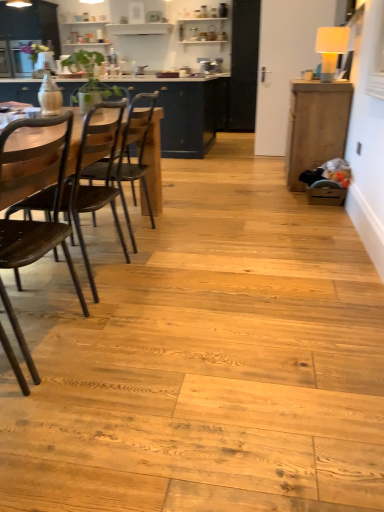
You are a GUI agent. You are given a task and a screenshot of the screen. Output one action in this format:
    pyautogui.click(x=<x>, y=<y>)
    Task: Click on the wooden cabinet at right, acting as the 2th cabinetry starting from the left
    
    Given the screenshot: What is the action you would take?
    pyautogui.click(x=316, y=126)

The image size is (384, 512). Describe the element at coordinates (316, 126) in the screenshot. I see `wooden cabinet at right, marked as the 1th cabinetry in a front-to-back arrangement` at that location.

Locate an element on the screen. The height and width of the screenshot is (512, 384). wooden chair at left, positioned as the 3th chair in front-to-back order is located at coordinates (125, 155).

I want to click on wooden cabinet at right, which is the second cabinetry in back-to-front order, so click(316, 126).

Which is more to the right, matte dark wood cabinet at center, the second cabinetry positioned from the front, or wooden chair at left, positioned as the 3th chair in front-to-back order?

From the viewer's perspective, wooden chair at left, positioned as the 3th chair in front-to-back order, appears more on the right side.

In the scene shown: Which is behind, matte dark wood cabinet at center, the second cabinetry positioned from the front, or wooden chair at left, acting as the first chair starting from the back?

matte dark wood cabinet at center, the second cabinetry positioned from the front, is behind.

Is matte dark wood cabinet at center, which ranks as the 2th cabinetry in right-to-left order, outside of wooden chair at left, acting as the first chair starting from the back?

Yes, matte dark wood cabinet at center, which ranks as the 2th cabinetry in right-to-left order, is outside of wooden chair at left, acting as the first chair starting from the back.

Is matte dark wood cabinet at center, which ranks as the 2th cabinetry in right-to-left order, bigger than wooden chair at left, positioned as the 3th chair in front-to-back order?

Indeed, matte dark wood cabinet at center, which ranks as the 2th cabinetry in right-to-left order, has a larger size compared to wooden chair at left, positioned as the 3th chair in front-to-back order.

From a real-world perspective, who is located higher, dark brown wood chair at left, which is counted as the 3th chair, starting from the back, or dark wood chair at left, the 2th chair viewed from the front?

dark brown wood chair at left, which is counted as the 3th chair, starting from the back.

Where is `chair on the left side of dark wood chair at left, positioned as the second chair in back-to-front order`? chair on the left side of dark wood chair at left, positioned as the second chair in back-to-front order is located at coordinates (34, 190).

Is dark wood chair at left, the 2th chair viewed from the front, a part of dark brown wood chair at left, acting as the first chair starting from the front?

That's incorrect, dark wood chair at left, the 2th chair viewed from the front, is not inside dark brown wood chair at left, acting as the first chair starting from the front.

Is dark brown wood chair at left, acting as the first chair starting from the front, smaller than wooden chair at left, positioned as the 3th chair in front-to-back order?

Correct, dark brown wood chair at left, acting as the first chair starting from the front, occupies less space than wooden chair at left, positioned as the 3th chair in front-to-back order.

Is dark brown wood chair at left, which is counted as the 3th chair, starting from the back, to the right of wooden chair at left, acting as the first chair starting from the back, from the viewer's perspective?

In fact, dark brown wood chair at left, which is counted as the 3th chair, starting from the back, is to the left of wooden chair at left, acting as the first chair starting from the back.

Could you tell me if dark brown wood chair at left, which is counted as the 3th chair, starting from the back, is turned towards wooden chair at left, acting as the first chair starting from the back?

No, dark brown wood chair at left, which is counted as the 3th chair, starting from the back, is not aimed at wooden chair at left, acting as the first chair starting from the back.

Which is nearer, (8,351) or (130,120)?

Point (8,351) is closer to the camera than point (130,120).

Considering the positions of points (112, 206) and (341, 134), is point (112, 206) farther from camera compared to point (341, 134)?

That is False.

Is dark wood chair at left, the 2th chair viewed from the front, situated inside wooden cabinet at right, marked as the 1th cabinetry in a front-to-back arrangement, or outside?

dark wood chair at left, the 2th chair viewed from the front, cannot be found inside wooden cabinet at right, marked as the 1th cabinetry in a front-to-back arrangement.

In the scene shown: Which of these two, dark wood chair at left, the 2th chair viewed from the front, or wooden cabinet at right, marked as the 1th cabinetry in a front-to-back arrangement, stands taller?

wooden cabinet at right, marked as the 1th cabinetry in a front-to-back arrangement.

In the image, there is a matte dark wood cabinet at center, the second cabinetry positioned from the front. At what (x,y) coordinates should I click in order to perform the action: click on cabinetry below it (from the image's perspective). Please return your answer as a coordinate pair (x, y). The image size is (384, 512). Looking at the image, I should click on (316, 126).

Does point (169, 89) appear closer or farther from the camera than point (335, 132)?

Clearly, point (169, 89) is more distant from the camera than point (335, 132).

From a real-world perspective, is matte dark wood cabinet at center, which ranks as the 2th cabinetry in right-to-left order, on wooden cabinet at right, marked as the 1th cabinetry in a front-to-back arrangement?

Indeed, from a real-world perspective, matte dark wood cabinet at center, which ranks as the 2th cabinetry in right-to-left order, stands above wooden cabinet at right, marked as the 1th cabinetry in a front-to-back arrangement.

Is matte dark wood cabinet at center, which ranks as the 2th cabinetry in right-to-left order, wider or thinner than wooden cabinet at right, which is the second cabinetry in back-to-front order?

Clearly, matte dark wood cabinet at center, which ranks as the 2th cabinetry in right-to-left order, has more width compared to wooden cabinet at right, which is the second cabinetry in back-to-front order.

Does point (92, 112) come behind point (120, 163)?

No, it is not.

From the image's perspective, is dark wood chair at left, positioned as the second chair in back-to-front order, below wooden chair at left, acting as the first chair starting from the back?

Yes.

Is dark wood chair at left, positioned as the second chair in back-to-front order, not close to wooden chair at left, positioned as the 3th chair in front-to-back order?

dark wood chair at left, positioned as the second chair in back-to-front order, is near wooden chair at left, positioned as the 3th chair in front-to-back order, not far away.

Which is more to the right, dark wood chair at left, the 2th chair viewed from the front, or wooden chair at left, acting as the first chair starting from the back?

wooden chair at left, acting as the first chair starting from the back, is more to the right.

Is the depth of wooden cabinet at right, marked as the 1th cabinetry in a front-to-back arrangement, greater than that of wooden chair at left, acting as the first chair starting from the back?

Yes, the depth of wooden cabinet at right, marked as the 1th cabinetry in a front-to-back arrangement, is greater than that of wooden chair at left, acting as the first chair starting from the back.

Considering the relative sizes of wooden cabinet at right, which ranks as the 1th cabinetry in right-to-left order, and wooden chair at left, acting as the first chair starting from the back, in the image provided, is wooden cabinet at right, which ranks as the 1th cabinetry in right-to-left order, bigger than wooden chair at left, acting as the first chair starting from the back,?

Yes.

Which of these two, wooden cabinet at right, acting as the 2th cabinetry starting from the left, or wooden chair at left, positioned as the 3th chair in front-to-back order, is thinner?

wooden cabinet at right, acting as the 2th cabinetry starting from the left.

This screenshot has width=384, height=512. Identify the location of the 1st chair in front of the matte dark wood cabinet at center, the first cabinetry positioned from the left. (125, 155).

At what (x,y) coordinates should I click in order to perform the action: click on the 1st chair to the right of the dark brown wood chair at left, which is counted as the 3th chair, starting from the back, counting from the anchor's position. Please return your answer as a coordinate pair (x, y). This screenshot has height=512, width=384. Looking at the image, I should click on (91, 184).

Which object lies further to the anchor point dark brown wood chair at left, which is counted as the 3th chair, starting from the back, matte dark wood cabinet at center, the second cabinetry positioned from the front, or wooden cabinet at right, which ranks as the 1th cabinetry in right-to-left order?

The object further to dark brown wood chair at left, which is counted as the 3th chair, starting from the back, is matte dark wood cabinet at center, the second cabinetry positioned from the front.

In the scene shown: Looking at the image, which one is located further to dark brown wood chair at left, which is counted as the 3th chair, starting from the back, wooden chair at left, acting as the first chair starting from the back, or matte dark wood cabinet at center, the first cabinetry positioned from the left?

Among the two, matte dark wood cabinet at center, the first cabinetry positioned from the left, is located further to dark brown wood chair at left, which is counted as the 3th chair, starting from the back.

Looking at the image, which one is located closer to wooden cabinet at right, marked as the 1th cabinetry in a front-to-back arrangement, wooden chair at left, positioned as the 3th chair in front-to-back order, or matte dark wood cabinet at center, arranged as the 1th cabinetry when viewed from the back?

The object closer to wooden cabinet at right, marked as the 1th cabinetry in a front-to-back arrangement, is wooden chair at left, positioned as the 3th chair in front-to-back order.

In the scene shown: Which object lies nearer to the anchor point dark wood chair at left, the 2th chair viewed from the front, wooden cabinet at right, acting as the 2th cabinetry starting from the left, or dark brown wood chair at left, acting as the first chair starting from the front?

dark brown wood chair at left, acting as the first chair starting from the front, is positioned closer to the anchor dark wood chair at left, the 2th chair viewed from the front.

Looking at this image, considering their positions, is dark brown wood chair at left, acting as the first chair starting from the front, positioned further to wooden chair at left, positioned as the 3th chair in front-to-back order, than dark wood chair at left, positioned as the second chair in back-to-front order?

The object further to wooden chair at left, positioned as the 3th chair in front-to-back order, is dark brown wood chair at left, acting as the first chair starting from the front.

Which object lies nearer to the anchor point wooden cabinet at right, acting as the 2th cabinetry starting from the left, dark wood chair at left, the 2th chair viewed from the front, or matte dark wood cabinet at center, arranged as the 1th cabinetry when viewed from the back?

Based on the image, matte dark wood cabinet at center, arranged as the 1th cabinetry when viewed from the back, appears to be nearer to wooden cabinet at right, acting as the 2th cabinetry starting from the left.

Which object lies nearer to the anchor point wooden chair at left, acting as the first chair starting from the back, matte dark wood cabinet at center, arranged as the 1th cabinetry when viewed from the back, or dark wood chair at left, positioned as the second chair in back-to-front order?

dark wood chair at left, positioned as the second chair in back-to-front order, is positioned closer to the anchor wooden chair at left, acting as the first chair starting from the back.

Based on their spatial positions, is wooden chair at left, acting as the first chair starting from the back, or dark wood chair at left, the 2th chair viewed from the front, closer to dark brown wood chair at left, acting as the first chair starting from the front?

dark wood chair at left, the 2th chair viewed from the front.

Locate an element on the screen. The image size is (384, 512). cabinetry between dark wood chair at left, positioned as the second chair in back-to-front order, and matte dark wood cabinet at center, the second cabinetry positioned from the front, in the front-back direction is located at coordinates (316, 126).

Where is `cabinetry positioned between dark brown wood chair at left, which is counted as the 3th chair, starting from the back, and matte dark wood cabinet at center, the first cabinetry positioned from the left, from near to far`? cabinetry positioned between dark brown wood chair at left, which is counted as the 3th chair, starting from the back, and matte dark wood cabinet at center, the first cabinetry positioned from the left, from near to far is located at coordinates (316, 126).

The width and height of the screenshot is (384, 512). What are the coordinates of `chair situated between dark wood chair at left, positioned as the second chair in back-to-front order, and wooden cabinet at right, which is the second cabinetry in back-to-front order, from left to right` in the screenshot? It's located at (125, 155).

This screenshot has width=384, height=512. What are the coordinates of `chair between dark brown wood chair at left, which is counted as the 3th chair, starting from the back, and wooden chair at left, acting as the first chair starting from the back, in the front-back direction` in the screenshot? It's located at (91, 184).